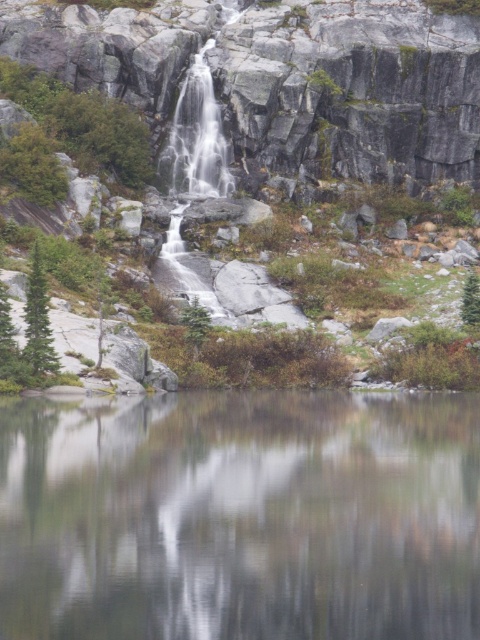
Is smooth reflective water at center shorter than green matte tree at center?

Correct, smooth reflective water at center is not as tall as green matte tree at center.

Between point (311, 625) and point (468, 298), which one is positioned behind?

The point (468, 298) is more distant.

Identify the location of smooth reflective water at center. (240, 516).

Is gray rock wall at upper center positioned at the back of green matte tree at left?

Yes, it is.

Who is more forward, (342,161) or (38,362)?

Positioned in front is point (38,362).

The width and height of the screenshot is (480, 640). I want to click on gray rock wall at upper center, so click(x=285, y=81).

Does smooth reflective water at center appear on the left side of green matte tree at left?

In fact, smooth reflective water at center is to the right of green matte tree at left.

Which is more to the right, smooth reflective water at center or green matte tree at left?

smooth reflective water at center is more to the right.

Is point (2, 470) positioned behind point (29, 272)?

No, it is not.

Locate an element on the screen. This screenshot has width=480, height=640. smooth reflective water at center is located at coordinates (240, 516).